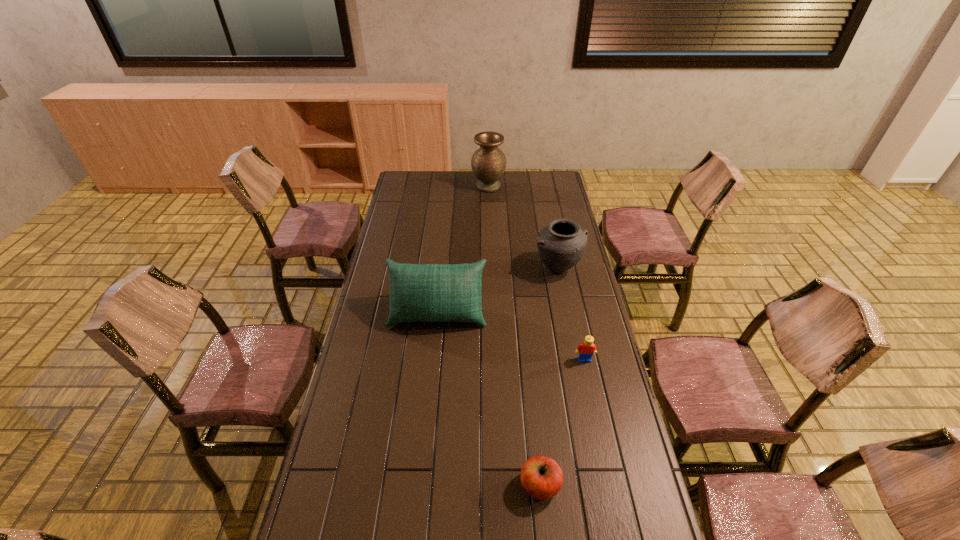
Locate an element on the screen. Image resolution: width=960 pixels, height=540 pixels. vacant space located 0.110m on the back of the apple is located at coordinates (535, 431).

I want to click on object situated at the far edge, so click(x=488, y=163).

Find the location of a particular element. The image size is (960, 540). object that is at the left edge is located at coordinates (429, 292).

The width and height of the screenshot is (960, 540). Find the location of `urn that is at the right edge`. urn that is at the right edge is located at coordinates (561, 244).

In order to click on Lego located at the right edge in this screenshot , I will do `click(587, 348)`.

Where is `vacant space at the far edge`? Image resolution: width=960 pixels, height=540 pixels. vacant space at the far edge is located at coordinates [x=430, y=185].

You are a GUI agent. You are given a task and a screenshot of the screen. Output one action in this format:
    pyautogui.click(x=<x>, y=<y>)
    Task: Click on the vacant region at the left edge
    The width and height of the screenshot is (960, 540).
    Given the screenshot: What is the action you would take?
    pyautogui.click(x=376, y=316)

Find the location of a particular element. vacant region at the right edge is located at coordinates (613, 390).

Identify the location of free space at the far left corner of the desktop. This screenshot has height=540, width=960. click(x=425, y=181).

Image resolution: width=960 pixels, height=540 pixels. I want to click on empty space that is in between the cushion and the tallest object, so click(x=463, y=249).